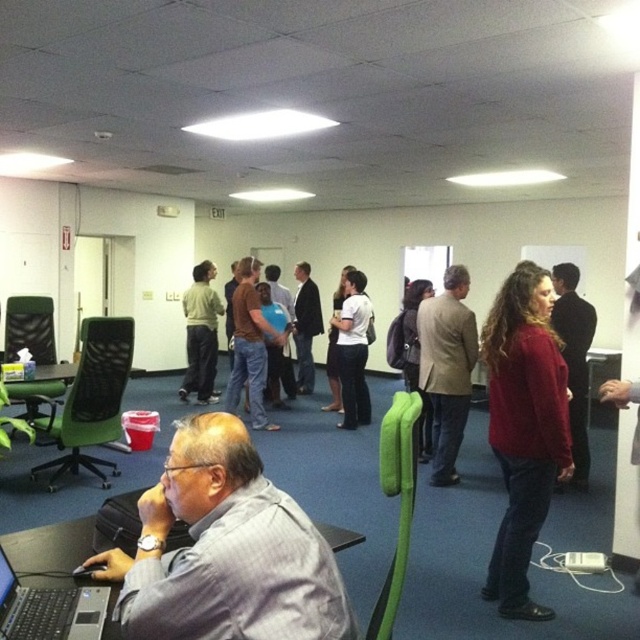
You are organizing a group photo and need to arrange two people based on their clothing. You have a person wearing a gray striped shirt at lower left and another in a light brown textured blazer at center. Which clothing item is positioned more to the left in the image?

The gray striped shirt at lower left is positioned more to the left than the light brown textured blazer at center.

You are a photographer positioned at the entrance of the room. You need to take a photo that includes both the gray striped shirt at lower left and the light brown textured blazer at center. Which of these two objects should you adjust your camera focus to first to ensure both are in focus?

The gray striped shirt at lower left is closer to the viewer than the light brown textured blazer at center. To ensure both are in focus, you should adjust your camera focus to the gray striped shirt at lower left first, as it is the closer object and adjusting focus starting from closer objects helps in capturing both in focus.

You are organizing a group photo and need to arrange the participants so that the gray striped shirt at lower left and the red sweater at center are visible. Based on their current positions, which participant should be closer to the camera to ensure both are visible?

The gray striped shirt at lower left is in front of the red sweater at center, so to ensure both are visible in the group photo, the gray striped shirt at lower left should be moved further away from the camera, allowing the red sweater at center to come into view behind them.